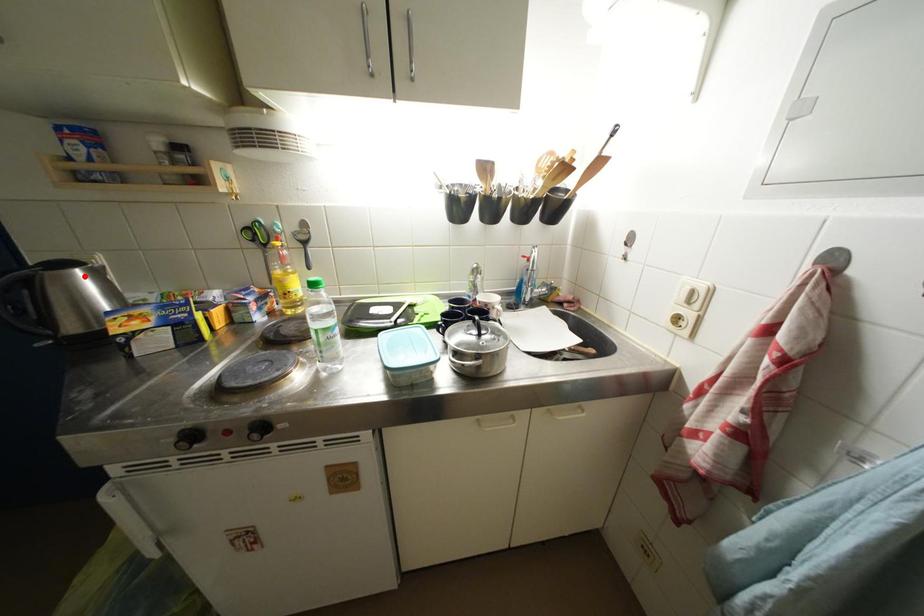
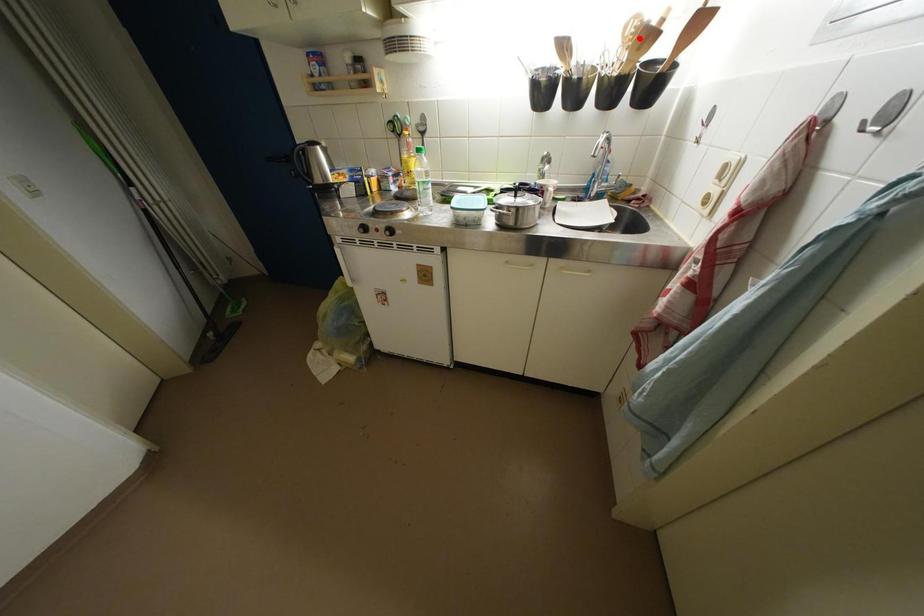
I am providing you with two images of the same scene from different viewpoints. A red point is marked on the first image and another point is marked on the second image. Is the red point in image1 aligned with the point shown in image2?

No